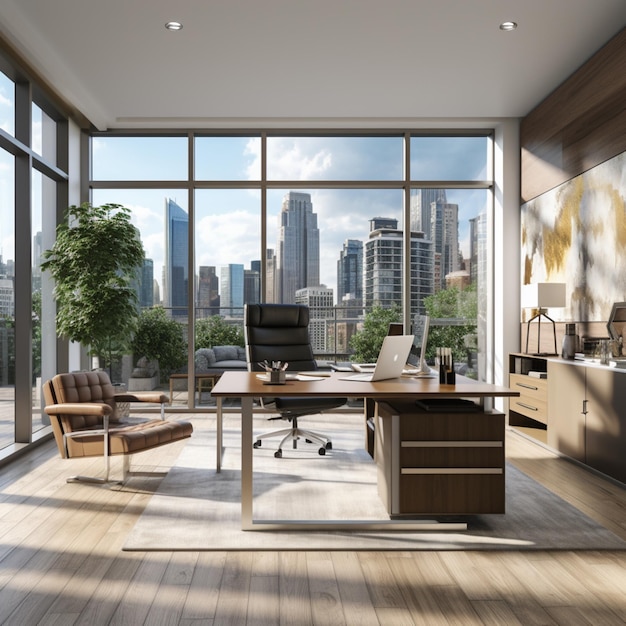
Where is `ceiling`? This screenshot has height=626, width=626. ceiling is located at coordinates (101, 24), (486, 67).